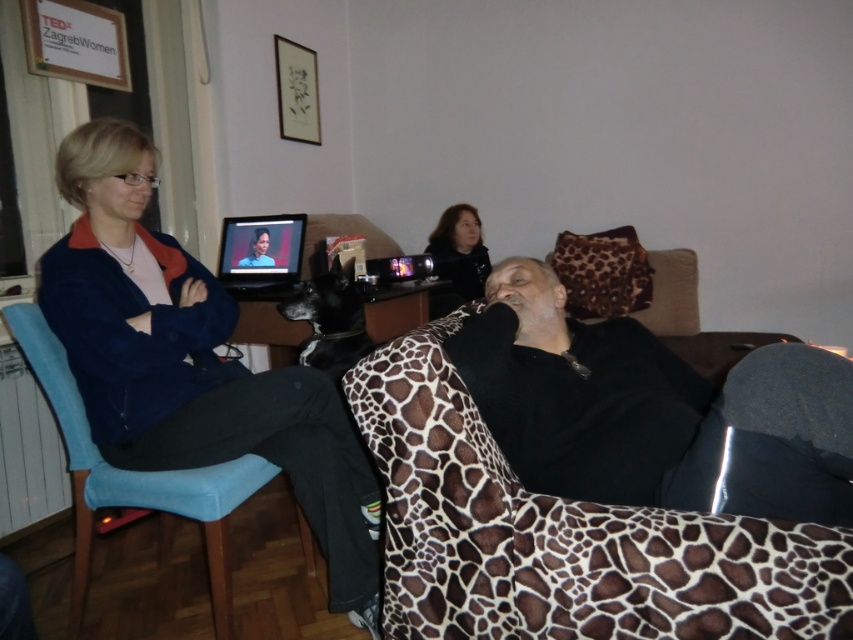
Question: Which of the following is the closest to the observer?

Choices:
 (A) (466, 260)
 (B) (799, 435)
 (C) (200, 285)

Answer: (B)

Question: Which object is closer to the camera taking this photo?

Choices:
 (A) black matte shirt at center
 (B) smooth black hair at center

Answer: (A)

Question: Where is matte blue jacket at left located in relation to blue fabric chair at left in the image?

Choices:
 (A) left
 (B) right

Answer: (B)

Question: Is black matte shirt at center to the left of blue fabric chair at left from the viewer's perspective?

Choices:
 (A) no
 (B) yes

Answer: (A)

Question: Is black matte shirt at center wider than blue fabric chair at left?

Choices:
 (A) yes
 (B) no

Answer: (A)

Question: Among these objects, which one is nearest to the camera?

Choices:
 (A) blue fabric chair at left
 (B) matte blue jacket at left
 (C) smooth black hair at center

Answer: (B)